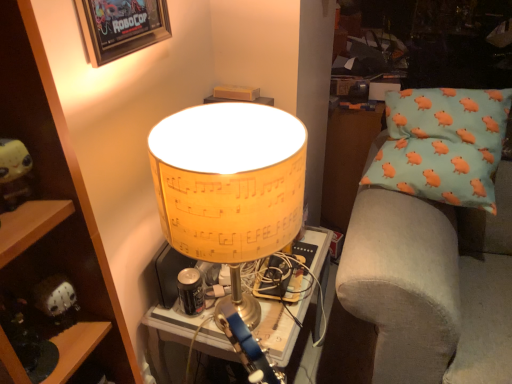
Question: From a real-world perspective, is wooden framed poster at upper left beneath yellow paper lampshade at center?

Choices:
 (A) yes
 (B) no

Answer: (B)

Question: Is wooden framed poster at upper left not near yellow paper lampshade at center?

Choices:
 (A) yes
 (B) no

Answer: (B)

Question: Can you confirm if wooden framed poster at upper left is bigger than yellow paper lampshade at center?

Choices:
 (A) no
 (B) yes

Answer: (A)

Question: Is wooden framed poster at upper left surrounding yellow paper lampshade at center?

Choices:
 (A) yes
 (B) no

Answer: (B)

Question: Is wooden framed poster at upper left to the right of yellow paper lampshade at center from the viewer's perspective?

Choices:
 (A) no
 (B) yes

Answer: (A)

Question: Based on their sizes in the image, would you say yellow plush toy at left is bigger or smaller than yellow paper lampshade at center?

Choices:
 (A) small
 (B) big

Answer: (A)

Question: Based on their positions, is yellow plush toy at left located to the left or right of yellow paper lampshade at center?

Choices:
 (A) right
 (B) left

Answer: (B)

Question: From a real-world perspective, relative to yellow paper lampshade at center, is yellow plush toy at left vertically above or below?

Choices:
 (A) below
 (B) above

Answer: (B)

Question: From the image's perspective, is yellow plush toy at left above or below yellow paper lampshade at center?

Choices:
 (A) above
 (B) below

Answer: (A)

Question: From their relative heights in the image, would you say yellow paper lampshade at center is taller or shorter than light blue fabric pillow with orange pig patterns at right?

Choices:
 (A) short
 (B) tall

Answer: (A)

Question: Choose the correct answer: Is yellow paper lampshade at center inside light blue fabric pillow with orange pig patterns at right or outside it?

Choices:
 (A) inside
 (B) outside

Answer: (B)

Question: From a real-world perspective, is yellow paper lampshade at center positioned above or below light blue fabric pillow with orange pig patterns at right?

Choices:
 (A) below
 (B) above

Answer: (B)

Question: Would you say yellow paper lampshade at center is to the left or to the right of light blue fabric pillow with orange pig patterns at right in the picture?

Choices:
 (A) left
 (B) right

Answer: (A)

Question: From the image's perspective, is yellow paper lampshade at center located above or below wooden shelf at left?

Choices:
 (A) above
 (B) below

Answer: (A)

Question: In terms of width, does yellow paper lampshade at center look wider or thinner when compared to wooden shelf at left?

Choices:
 (A) thin
 (B) wide

Answer: (B)